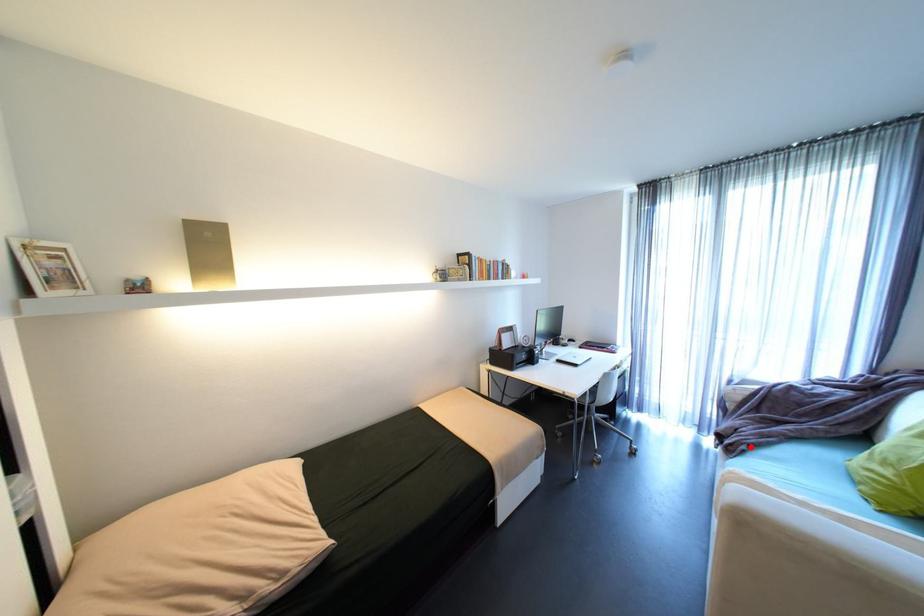
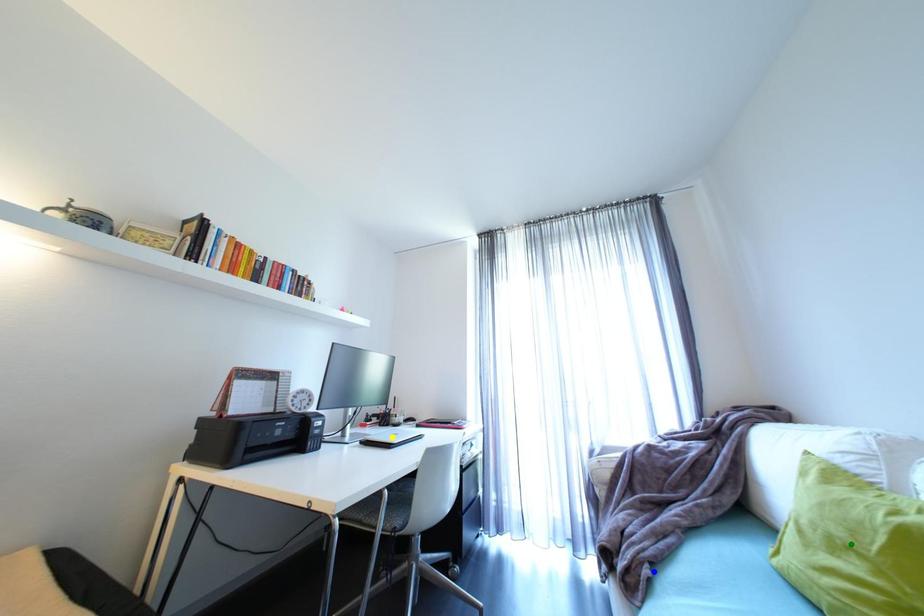
Question: I am providing you with two images of the same scene from different viewpoints. A red point is marked on the first image. You are given multiple points on the second image. In image 2, which mark is for the same physical point as the one in image 1?

Choices:
 (A) blue point
 (B) yellow point
 (C) green point

Answer: (A)